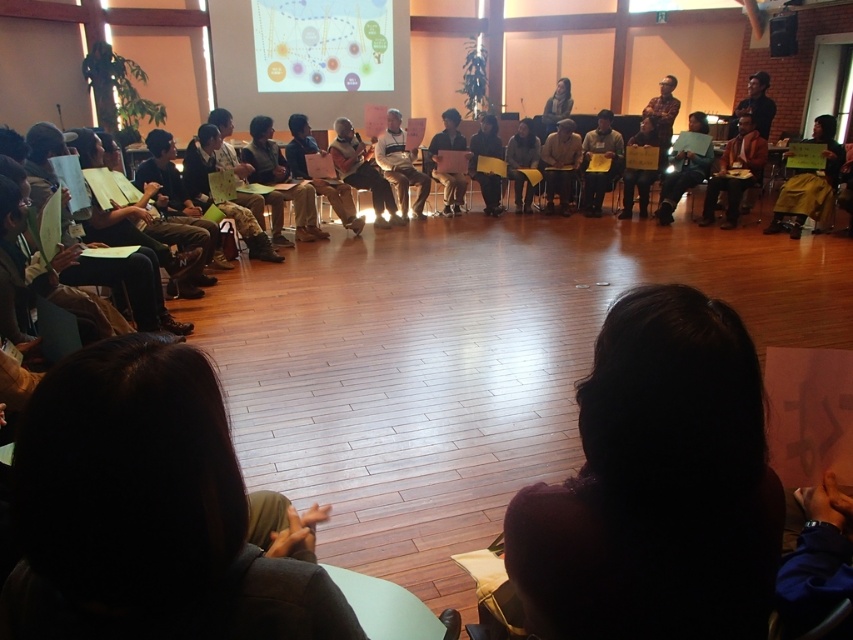
You are standing at the center of the room and want to move to the brown leather jacket at right. Which direction should you move to reach it?

Since the brown leather jacket at right is located at point 0.269 on the x and 0.863 on the y, which is towards the right side and lower part of the room, you should move to your right and slightly forward to reach it.

You are standing at the origin point of the coordinate system in the room. Where is the dark blue shirt at center located in terms of coordinates?

The dark blue shirt at center is located at coordinates point (175, 193).